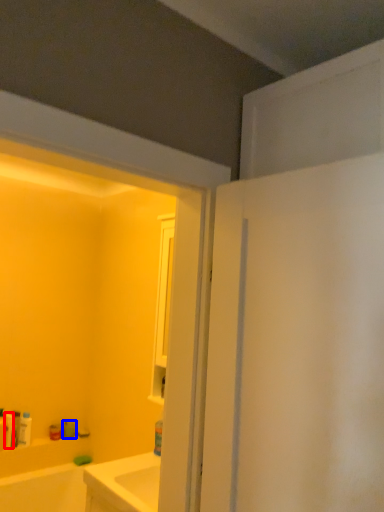
Question: Which of the following is the closest to the observer, toiletry (highlighted by a red box) or toiletry (highlighted by a blue box)?

Choices:
 (A) toiletry
 (B) toiletry

Answer: (A)